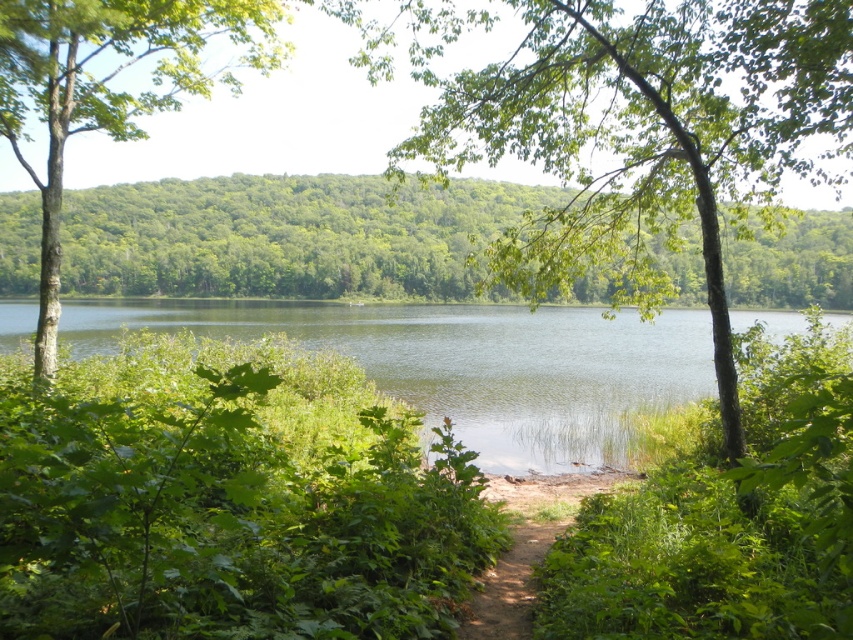
Question: Does green leafy tree at center have a lesser width compared to green leafy tree at upper center?

Choices:
 (A) yes
 (B) no

Answer: (A)

Question: Which is farther from the green leafy tree at left?

Choices:
 (A) green leafy tree at upper center
 (B) green leafy tree at center
 (C) clear water at center

Answer: (A)

Question: Observing the image, what is the correct spatial positioning of green leafy tree at center in reference to dirt path at center?

Choices:
 (A) above
 (B) below

Answer: (A)

Question: Estimate the real-world distances between objects in this image. Which object is farther from the green leafy tree at upper center?

Choices:
 (A) green leafy tree at left
 (B) dirt path at center

Answer: (B)

Question: Does clear water at center appear over dirt path at center?

Choices:
 (A) no
 (B) yes

Answer: (B)

Question: Estimate the real-world distances between objects in this image. Which object is farther from the green leafy tree at center?

Choices:
 (A) green leafy tree at left
 (B) clear water at center

Answer: (B)